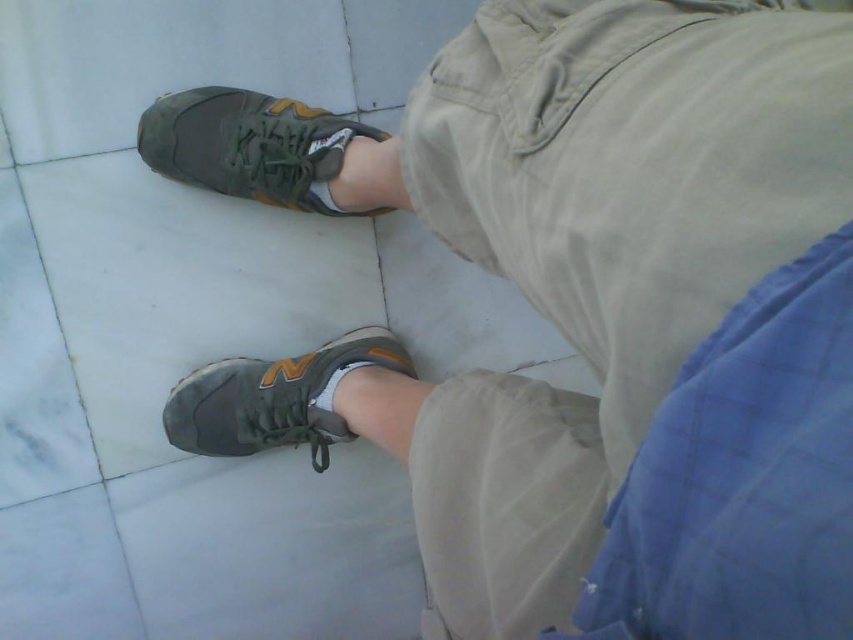
You are taking a photo of the scene and want to focus on both the point at (312, 115) and the point at (221, 401). Which point should you adjust your focus to first to ensure it is in the foreground?

Point at (312, 115) should be focused first because it is closer to the viewer than point at (221, 401), making it the foreground element.

You are a photographer setting up a shoot in the scene described. You want to place a small prop between the matte gray running shoe at lower center and the matte gray shoe at lower center. The prop is 10 centimeters wide. Will it fit between them?

The distance between the matte gray running shoe at lower center and the matte gray shoe at lower center is 9.98 centimeters, which is slightly less than the prop width of 10 centimeters. Therefore, the prop will not fit between them.

You are a photographer trying to capture the exact spot where the matte gray running shoe at lower center is located. Given that the coordinate system starts at the bottom left corner of the image, can you confirm if the point at coordinate (276,397) marks the location of the matte gray running shoe at lower center?

Yes, the point at coordinate (276,397) marks the location of the matte gray running shoe at lower center as stated in the description.